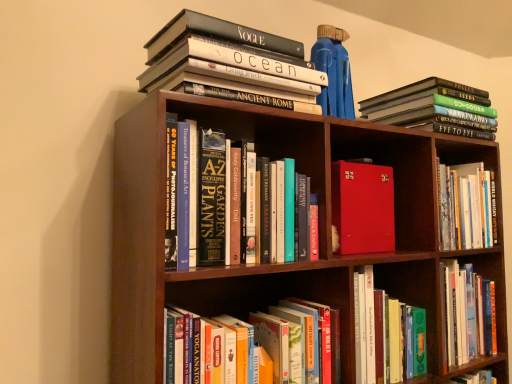
Question: Looking at their shapes, would you say hardcover book at lower center, which ranks as the first book in bottom-to-top order, is wider or thinner than red leather-bound book at center, which is counted as the 2th book, starting from the bottom?

Choices:
 (A) thin
 (B) wide

Answer: (A)

Question: From a real-world perspective, relative to red leather-bound book at center, which is counted as the 2th book, starting from the bottom, is hardcover book at lower center, the 5th book positioned from the top, vertically above or below?

Choices:
 (A) above
 (B) below

Answer: (B)

Question: Which of these objects is positioned farthest from the hardcover book at center, the third book positioned from the top?

Choices:
 (A) red leather-bound book at center, which is the fourth book in top-to-bottom order
 (B) hardcover book at upper left, which is the 5th book in bottom-to-top order
 (C) hardcover books at upper right, which is the 4th book in bottom-to-top order
 (D) hardcover book at lower center, the 5th book positioned from the top

Answer: (C)

Question: Which object is the closest to the hardcover book at upper left, which is the 5th book in bottom-to-top order?

Choices:
 (A) hardcover book at lower center, the 5th book positioned from the top
 (B) hardcover book at center, marked as the 3th book in a bottom-to-top arrangement
 (C) hardcover books at upper right, which is the 4th book in bottom-to-top order
 (D) red leather-bound book at center, which is counted as the 2th book, starting from the bottom

Answer: (B)